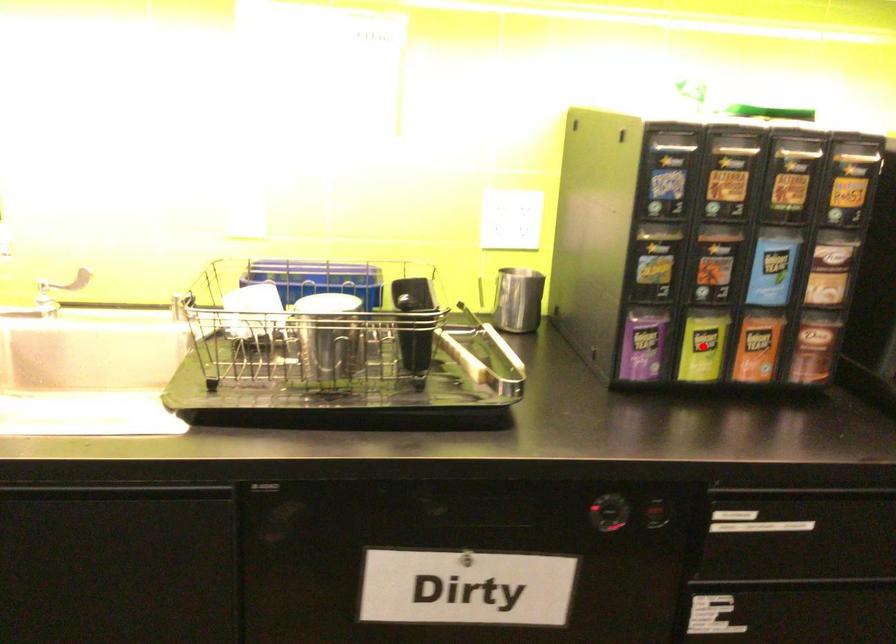
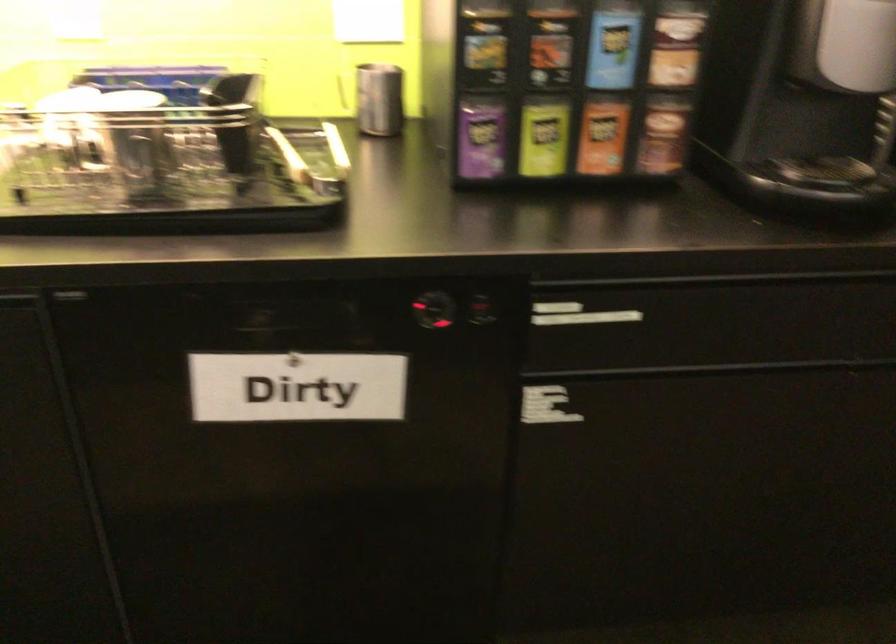
The point at the highlighted location is marked in the first image. Where is the corresponding point in the second image?

(543, 138)